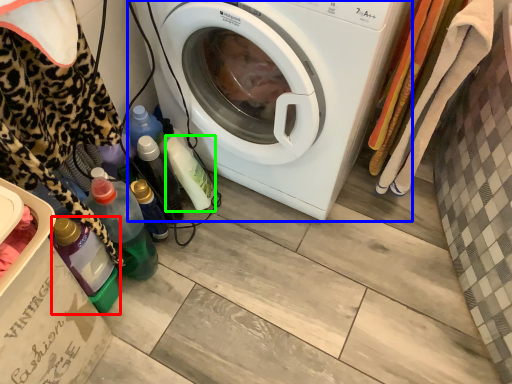
Question: Estimate the real-world distances between objects in this image. Which object is farther from bottle (highlighted by a red box), washing machine (highlighted by a blue box) or bottle (highlighted by a green box)?

Choices:
 (A) washing machine
 (B) bottle

Answer: (A)